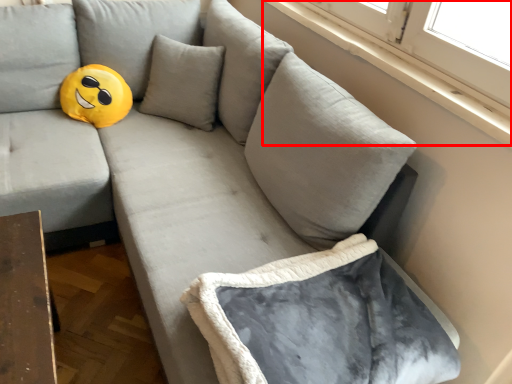
Question: From the image's perspective, what is the correct spatial relationship of window sill (annotated by the red box) in relation to bean bag chair?

Choices:
 (A) above
 (B) below

Answer: (A)